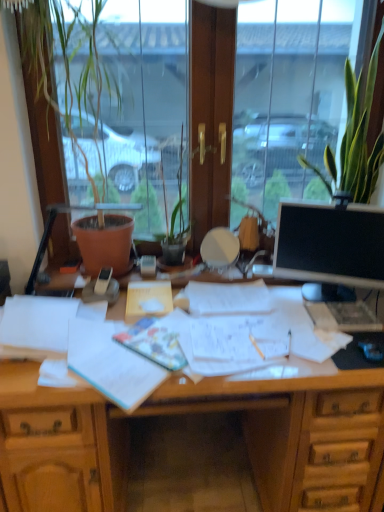
This screenshot has height=512, width=384. Find the location of `empty space that is ontop of white paper at center, the first document when ordered from back to front (from a real-world perspective)`. empty space that is ontop of white paper at center, the first document when ordered from back to front (from a real-world perspective) is located at coordinates (151, 290).